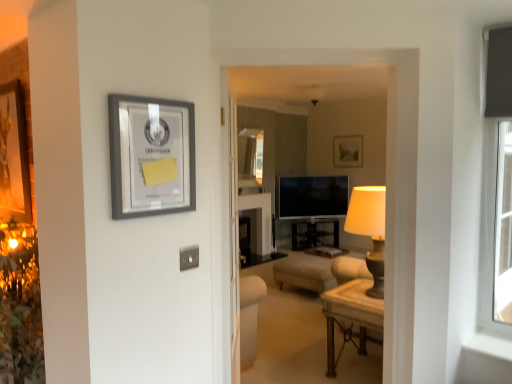
Question: From the image's perspective, is wooden polished table at center under matte gray picture frame at upper left?

Choices:
 (A) yes
 (B) no

Answer: (A)

Question: Does wooden polished table at center have a smaller size compared to matte gray picture frame at upper left?

Choices:
 (A) yes
 (B) no

Answer: (B)

Question: Does wooden polished table at center come behind matte gray picture frame at upper left?

Choices:
 (A) no
 (B) yes

Answer: (B)

Question: From the image's perspective, is wooden polished table at center on top of matte gray picture frame at upper left?

Choices:
 (A) yes
 (B) no

Answer: (B)

Question: Are wooden polished table at center and matte gray picture frame at upper left making contact?

Choices:
 (A) no
 (B) yes

Answer: (A)

Question: Choose the correct answer: Is wooden polished table at center inside matte gray picture frame at upper left or outside it?

Choices:
 (A) inside
 (B) outside

Answer: (B)

Question: From a real-world perspective, is wooden polished table at center positioned above or below matte gray picture frame at upper left?

Choices:
 (A) below
 (B) above

Answer: (A)

Question: Considering the positions of wooden polished table at center and matte gray picture frame at upper left in the image, is wooden polished table at center bigger or smaller than matte gray picture frame at upper left?

Choices:
 (A) small
 (B) big

Answer: (B)

Question: Is point (339, 317) closer or farther from the camera than point (159, 134)?

Choices:
 (A) closer
 (B) farther

Answer: (B)

Question: From a real-world perspective, is wooden polished table at center above or below matte black tv at center?

Choices:
 (A) above
 (B) below

Answer: (B)

Question: Looking at the image, does wooden polished table at center seem bigger or smaller compared to matte black tv at center?

Choices:
 (A) small
 (B) big

Answer: (B)

Question: Is wooden polished table at center situated inside matte black tv at center or outside?

Choices:
 (A) outside
 (B) inside

Answer: (A)

Question: Is wooden polished table at center taller or shorter than matte black tv at center?

Choices:
 (A) tall
 (B) short

Answer: (B)

Question: Looking at their shapes, would you say matte gray picture frame at upper left is wider or thinner than wooden polished table at center?

Choices:
 (A) wide
 (B) thin

Answer: (B)

Question: In the image, is matte gray picture frame at upper left on the left side or the right side of wooden polished table at center?

Choices:
 (A) right
 (B) left

Answer: (B)